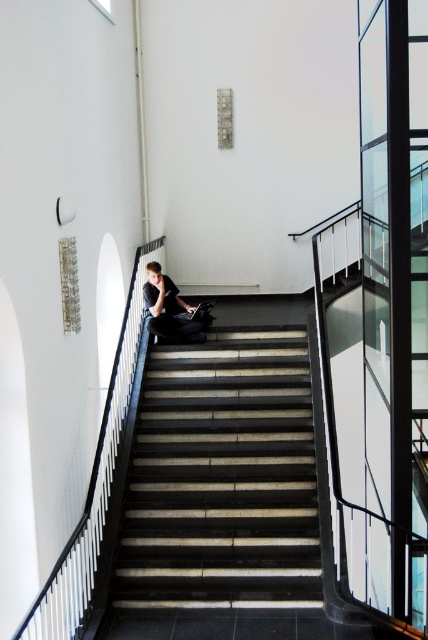
Question: Does dark gray concrete stairs at center appear on the left side of dark gray fabric jacket at center?

Choices:
 (A) no
 (B) yes

Answer: (A)

Question: Can you confirm if dark gray concrete stairs at center is bigger than dark gray fabric jacket at center?

Choices:
 (A) yes
 (B) no

Answer: (A)

Question: Can you confirm if dark gray concrete stairs at center is positioned to the left of dark gray fabric jacket at center?

Choices:
 (A) yes
 (B) no

Answer: (B)

Question: Which point appears farthest from the camera in this image?

Choices:
 (A) (228, 419)
 (B) (158, 276)

Answer: (B)

Question: Among these objects, which one is nearest to the camera?

Choices:
 (A) dark gray concrete stairs at center
 (B) dark gray fabric jacket at center

Answer: (A)

Question: Which object is closer to the camera taking this photo?

Choices:
 (A) dark gray fabric jacket at center
 (B) dark gray concrete stairs at center

Answer: (B)